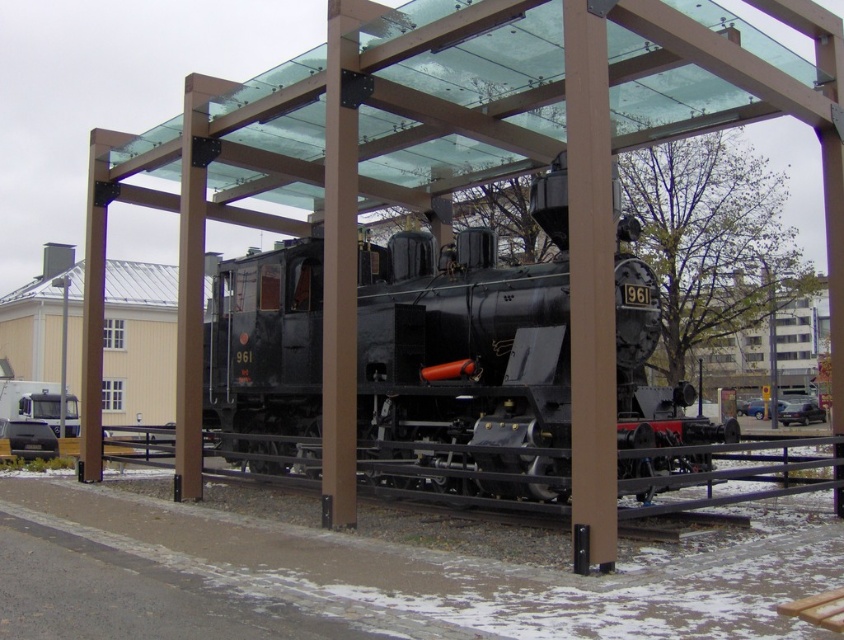
Can you confirm if matte black locomotive at center is positioned to the right of black metal rail at center?

Incorrect, matte black locomotive at center is not on the right side of black metal rail at center.

Can you confirm if matte black locomotive at center is positioned above black metal rail at center?

Correct, matte black locomotive at center is located above black metal rail at center.

Is point (231, 333) positioned before point (637, 483)?

No, it is behind (637, 483).

I want to click on matte black locomotive at center, so tap(466, 336).